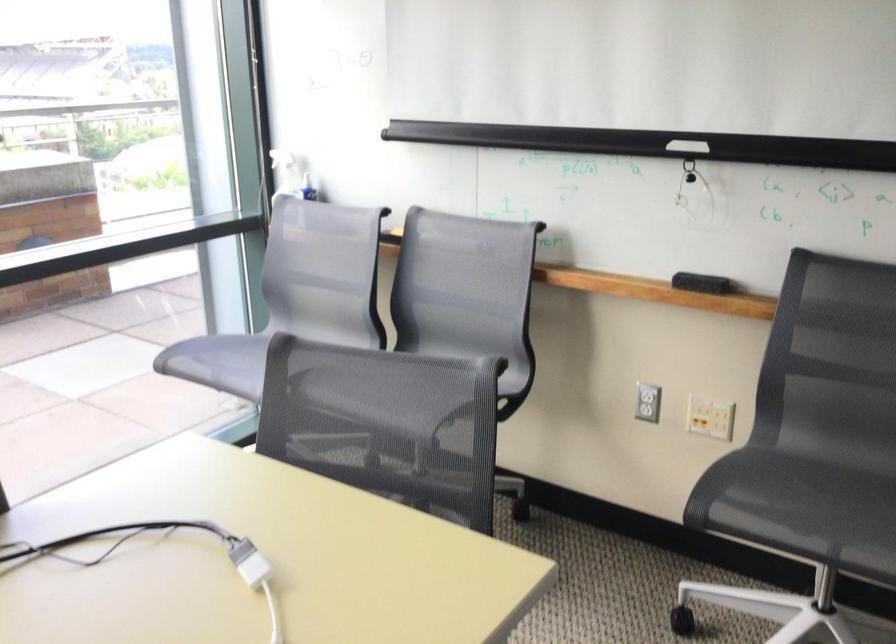
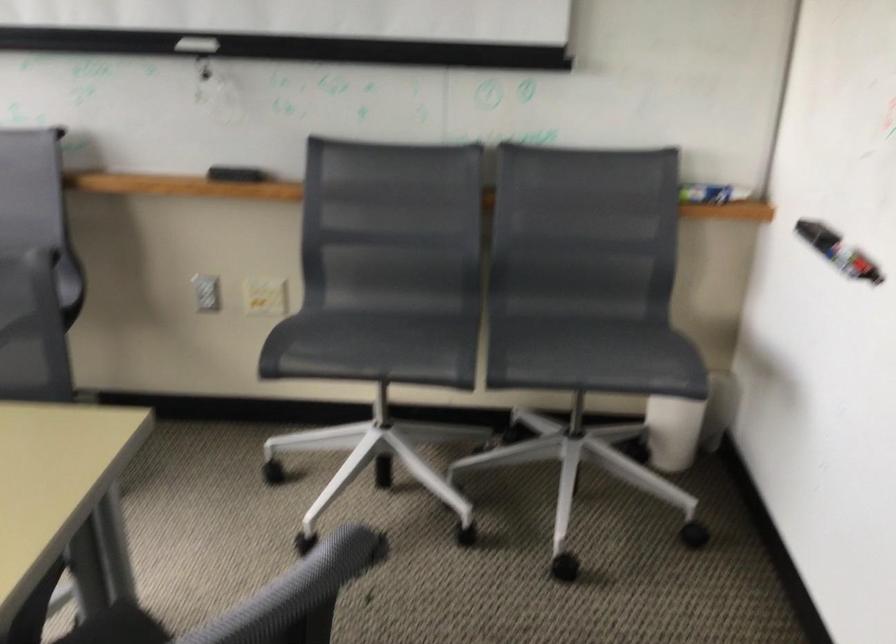
Question: The images are taken continuously from a first-person perspective. In which direction is your viewpoint rotating?

Choices:
 (A) Left
 (B) Right
 (C) Up
 (D) Down

Answer: (B)